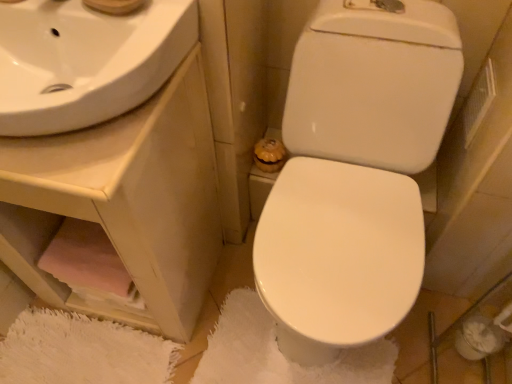
Question: Is point (376, 9) closer or farther from the camera than point (74, 74)?

Choices:
 (A) farther
 (B) closer

Answer: (A)

Question: In terms of height, does white glossy toilet at center look taller or shorter compared to white glossy sink at upper left?

Choices:
 (A) short
 (B) tall

Answer: (B)

Question: Based on their relative distances, which object is farther from the white glossy sink at upper left?

Choices:
 (A) white glossy toilet at center
 (B) white glossy sink at upper left
 (C) pink fabric at lower left
 (D) white fluffy bath mat at center

Answer: (D)

Question: Which object is positioned farthest from the pink fabric at lower left?

Choices:
 (A) white glossy toilet at center
 (B) white glossy sink at upper left
 (C) white glossy sink at upper left
 (D) white fluffy bath mat at center

Answer: (A)